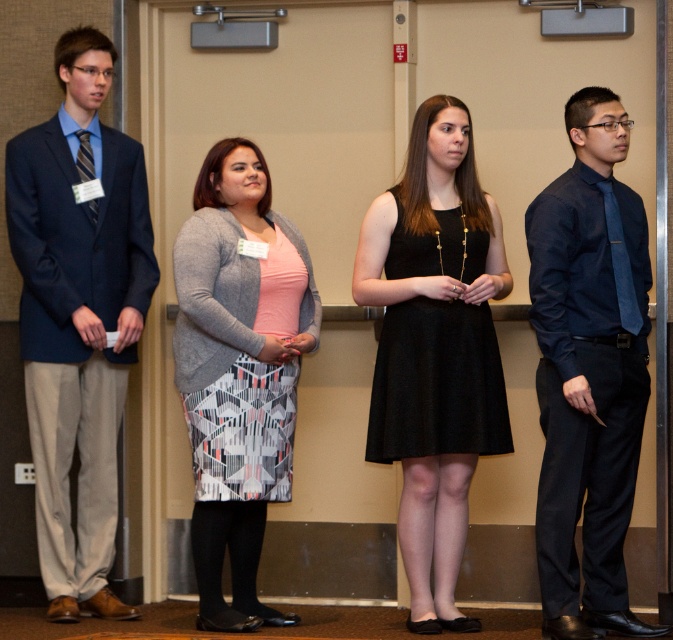
Does matte blue suit at left have a smaller size compared to black satin dress at center?

Incorrect, matte blue suit at left is not smaller in size than black satin dress at center.

Between matte blue suit at left and black satin dress at center, which one is positioned higher?

Positioned higher is matte blue suit at left.

Who is more forward, (77, 609) or (365, 257)?

Point (365, 257)

Where is `matte blue suit at left`? matte blue suit at left is located at coordinates (77, 316).

At what (x,y) coordinates should I click in order to perform the action: click on navy blue shirt at right. Please return your answer as a coordinate pair (x, y). Image resolution: width=673 pixels, height=640 pixels. Looking at the image, I should click on (588, 371).

Which is behind, point (633, 326) or point (425, 452)?

The point (425, 452) is more distant.

Find the location of a particular element. navy blue shirt at right is located at coordinates (588, 371).

Can you confirm if black satin dress at center is positioned to the right of gray textured cardigan at center?

Indeed, black satin dress at center is positioned on the right side of gray textured cardigan at center.

Can you confirm if black satin dress at center is smaller than gray textured cardigan at center?

Yes, black satin dress at center is smaller than gray textured cardigan at center.

Between point (359, 259) and point (221, 257), which one is positioned behind?

Point (359, 259)

Find the location of a particular element. This screenshot has height=640, width=673. black satin dress at center is located at coordinates (433, 348).